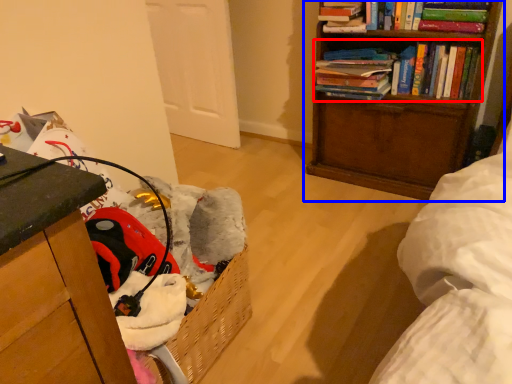
Question: Which point is further to the camera, book (highlighted by a red box) or bookcase (highlighted by a blue box)?

Choices:
 (A) book
 (B) bookcase

Answer: (A)